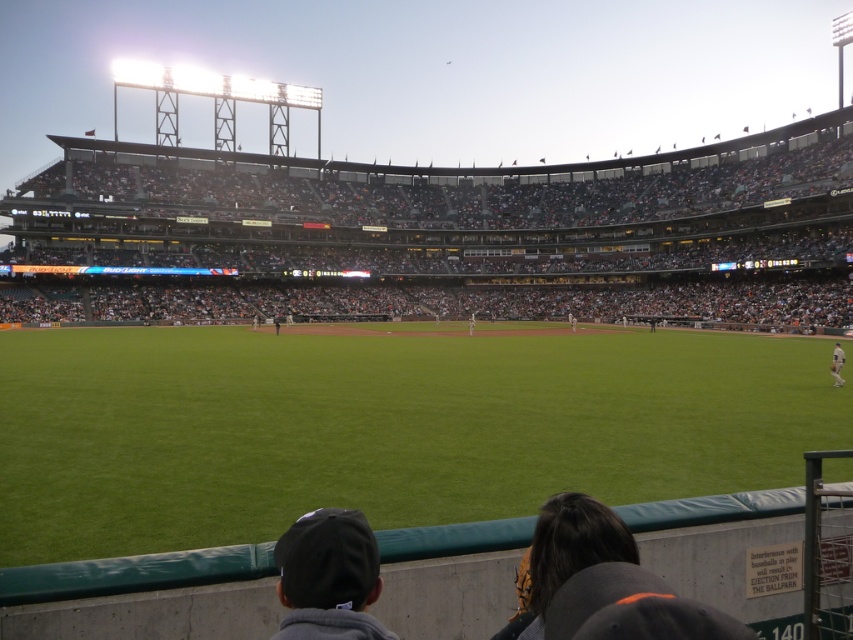
You are standing at the edge of the stadium seating where the spectators are seated. You want to walk to the green grass at center. Is the point at coordinates (381, 428) on the green grass at center?

Yes, the point at coordinates (381, 428) is on the green grass at center, so you can walk directly to that point.

You are a photographer standing at the edge of the stadium seating. You want to take a photo of the white uniform at center and the dark gray fabric cap at lower center. Which object should you adjust your camera focus to first if you want both to be in the frame?

The dark gray fabric cap at lower center is positioned on the left side of white uniform at center. Since the dark gray fabric cap is closer to the photographer, you should focus on it first to ensure both are in the frame.

You are a photographer trying to capture a closeup of the dark gray fabric cap at lower center and the white uniform at center. Which object will appear smaller in your photo?

The dark gray fabric cap at lower center is thinner than the white uniform at center, so it will appear smaller in the photo.